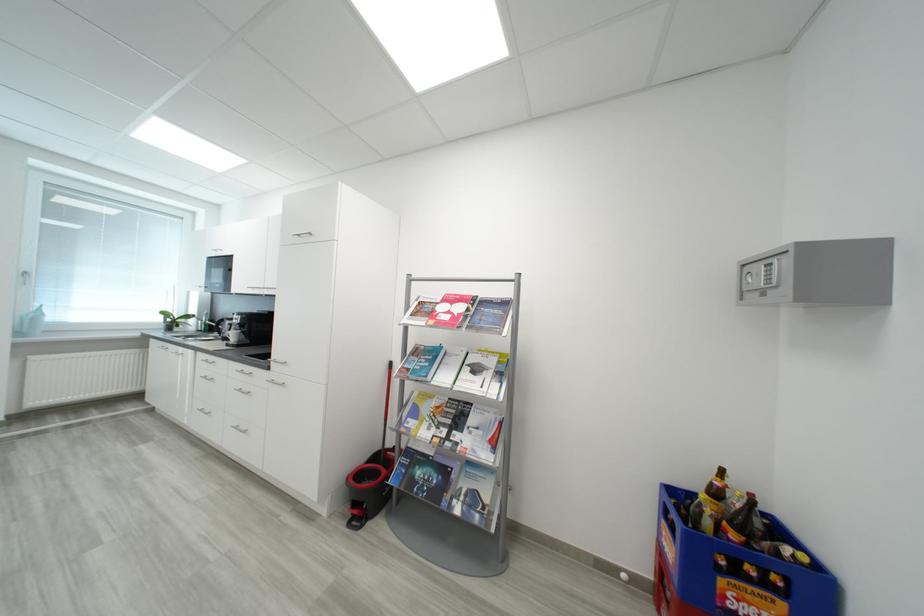
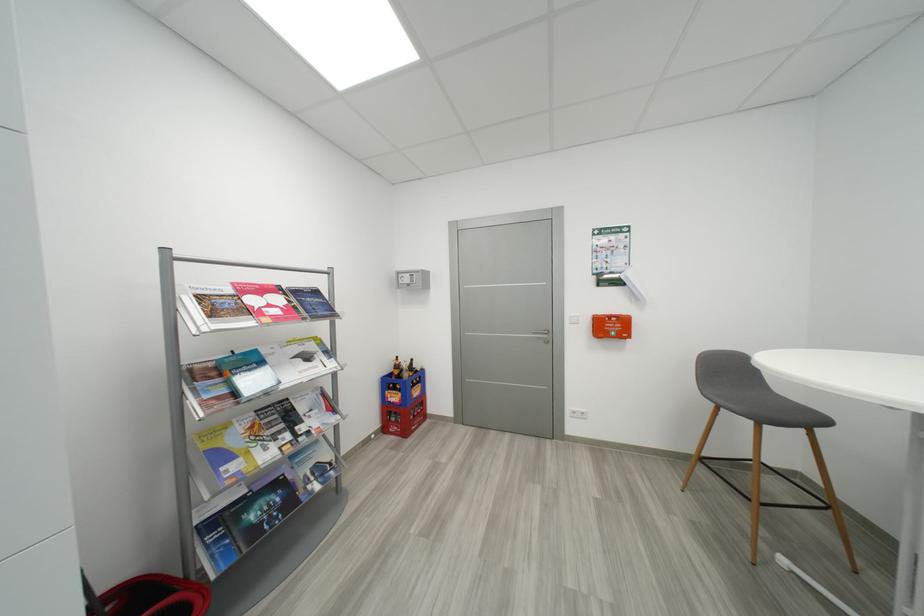
The point at (x=456, y=317) is marked in the first image. Where is the corresponding point in the second image?

(286, 310)